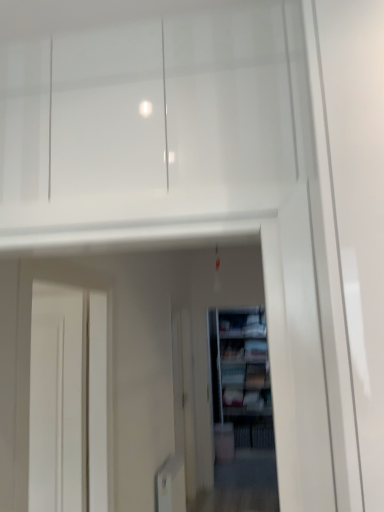
Question: Considering the relative sizes of wooden bookshelf at center and matte white cabinet at center in the image provided, is wooden bookshelf at center shorter than matte white cabinet at center?

Choices:
 (A) yes
 (B) no

Answer: (B)

Question: Could you tell me if wooden bookshelf at center is facing matte white cabinet at center?

Choices:
 (A) no
 (B) yes

Answer: (A)

Question: Does wooden bookshelf at center come behind matte white cabinet at center?

Choices:
 (A) no
 (B) yes

Answer: (A)

Question: Are wooden bookshelf at center and matte white cabinet at center making contact?

Choices:
 (A) yes
 (B) no

Answer: (B)

Question: Does wooden bookshelf at center have a greater width compared to matte white cabinet at center?

Choices:
 (A) no
 (B) yes

Answer: (A)

Question: Does point pos(190,429) appear closer or farther from the camera than point pos(256,329)?

Choices:
 (A) closer
 (B) farther

Answer: (A)

Question: Is white glossy screen door at center in front of or behind matte white cabinet at center in the image?

Choices:
 (A) behind
 (B) front

Answer: (B)

Question: From a real-world perspective, is white glossy screen door at center above or below matte white cabinet at center?

Choices:
 (A) below
 (B) above

Answer: (A)

Question: Considering the positions of white glossy screen door at center and matte white cabinet at center in the image, is white glossy screen door at center bigger or smaller than matte white cabinet at center?

Choices:
 (A) big
 (B) small

Answer: (A)

Question: In terms of height, does matte white cabinet at center look taller or shorter compared to wooden bookshelf at center?

Choices:
 (A) tall
 (B) short

Answer: (B)

Question: Does point (263, 332) appear closer or farther from the camera than point (211, 333)?

Choices:
 (A) closer
 (B) farther

Answer: (B)

Question: Considering the positions of matte white cabinet at center and wooden bookshelf at center in the image, is matte white cabinet at center bigger or smaller than wooden bookshelf at center?

Choices:
 (A) small
 (B) big

Answer: (A)

Question: From the image's perspective, is matte white cabinet at center above or below wooden bookshelf at center?

Choices:
 (A) below
 (B) above

Answer: (B)

Question: Looking at the image, does wooden bookshelf at center seem bigger or smaller compared to matte white cabinet at center?

Choices:
 (A) big
 (B) small

Answer: (A)

Question: Considering the positions of point (238, 386) and point (251, 316), is point (238, 386) closer or farther from the camera than point (251, 316)?

Choices:
 (A) farther
 (B) closer

Answer: (B)